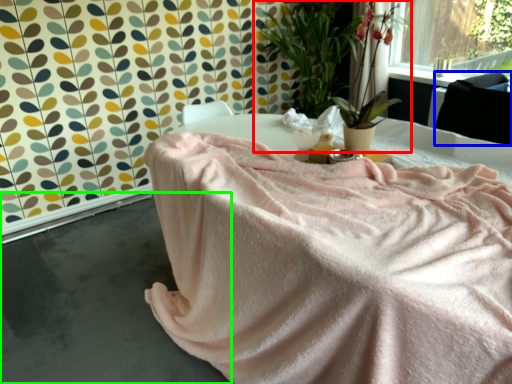
Question: Which is nearer to the houseplant (highlighted by a red box)? satin (highlighted by a blue box) or concrete (highlighted by a green box).

Choices:
 (A) satin
 (B) concrete

Answer: (A)